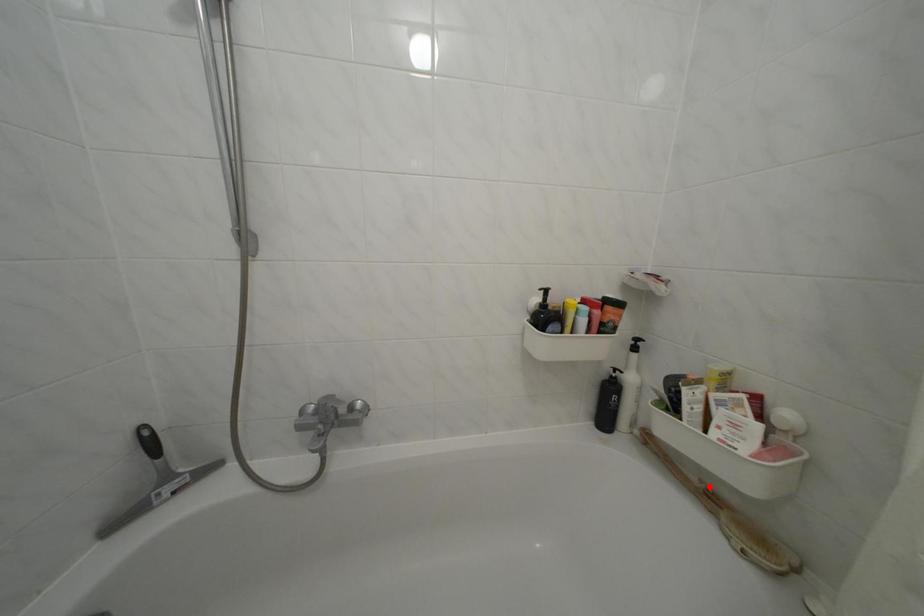
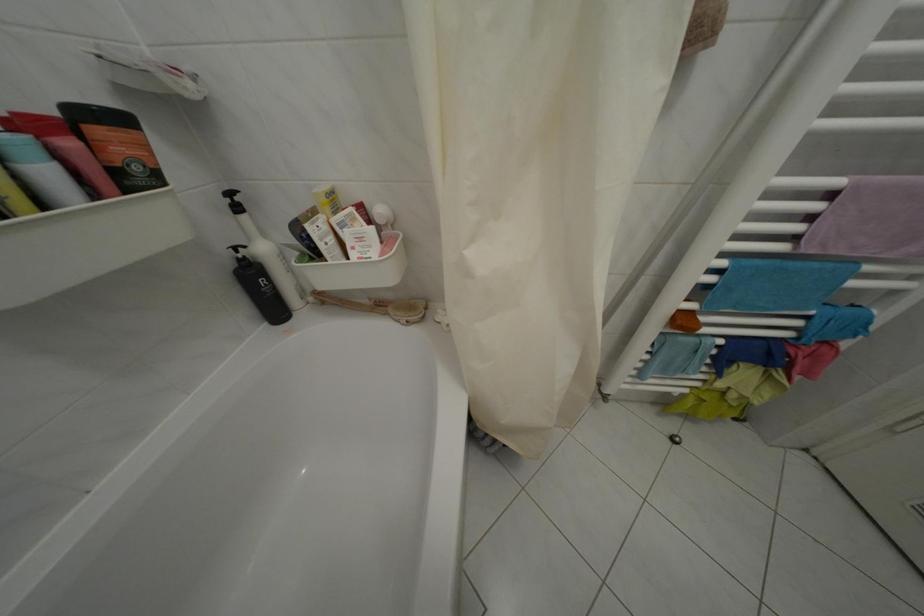
Locate, in the second image, the point that corresponds to the highlighted location in the first image.

(379, 306)